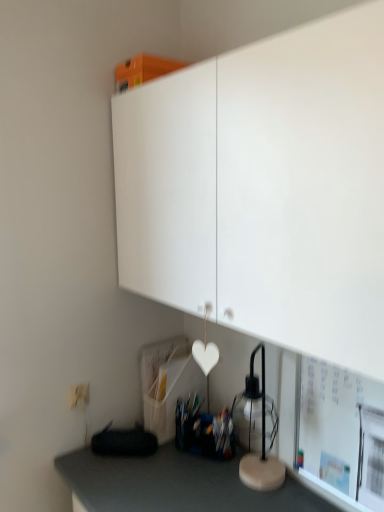
Question: From the image's perspective, is white matte electric outlet at lower left located above or below transparent glass table lamp at lower right?

Choices:
 (A) above
 (B) below

Answer: (B)

Question: Is white matte electric outlet at lower left spatially inside transparent glass table lamp at lower right, or outside of it?

Choices:
 (A) inside
 (B) outside

Answer: (B)

Question: Estimate the real-world distances between objects in this image. Which object is farther from the white matte electric outlet at lower left?

Choices:
 (A) transparent glass table lamp at lower right
 (B) white matte bulletin board at lower right
 (C) white matte cabinet at upper center

Answer: (C)

Question: Estimate the real-world distances between objects in this image. Which object is farther from the transparent glass table lamp at lower right?

Choices:
 (A) white matte electric outlet at lower left
 (B) white matte cabinet at upper center
 (C) white matte bulletin board at lower right

Answer: (B)